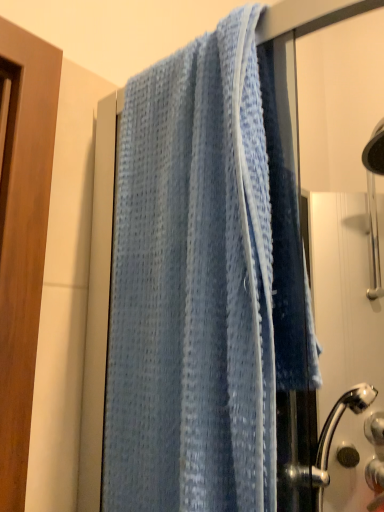
Question: Does light blue waffle-textured towel at center appear on the right side of matte black knob at lower right, acting as the second knob starting from the right?

Choices:
 (A) yes
 (B) no

Answer: (B)

Question: Considering the relative sizes of light blue waffle-textured towel at center and matte black knob at lower right, the first knob viewed from the left, in the image provided, is light blue waffle-textured towel at center taller than matte black knob at lower right, the first knob viewed from the left,?

Choices:
 (A) no
 (B) yes

Answer: (B)

Question: Does light blue waffle-textured towel at center appear on the left side of matte black knob at lower right, the first knob viewed from the left?

Choices:
 (A) no
 (B) yes

Answer: (B)

Question: Is light blue waffle-textured towel at center facing towards matte black knob at lower right, the first knob viewed from the left?

Choices:
 (A) yes
 (B) no

Answer: (B)

Question: From a real-world perspective, is light blue waffle-textured towel at center physically below matte black knob at lower right, acting as the second knob starting from the right?

Choices:
 (A) yes
 (B) no

Answer: (B)

Question: Does light blue waffle-textured towel at center have a greater width compared to matte black knob at lower right, acting as the second knob starting from the right?

Choices:
 (A) no
 (B) yes

Answer: (B)

Question: Is the surface of satin silver knob at lower right, positioned as the second knob in left-to-right order, in direct contact with light blue waffle-textured towel at center?

Choices:
 (A) yes
 (B) no

Answer: (B)

Question: Is satin silver knob at lower right, which appears as the first knob when viewed from the right, thinner than light blue waffle-textured towel at center?

Choices:
 (A) no
 (B) yes

Answer: (B)

Question: Would you say light blue waffle-textured towel at center is part of satin silver knob at lower right, which appears as the first knob when viewed from the right,'s contents?

Choices:
 (A) yes
 (B) no

Answer: (B)

Question: Considering the relative sizes of satin silver knob at lower right, which appears as the first knob when viewed from the right, and light blue waffle-textured towel at center in the image provided, is satin silver knob at lower right, which appears as the first knob when viewed from the right, shorter than light blue waffle-textured towel at center?

Choices:
 (A) yes
 (B) no

Answer: (A)

Question: From a real-world perspective, does satin silver knob at lower right, positioned as the second knob in left-to-right order, sit lower than light blue waffle-textured towel at center?

Choices:
 (A) no
 (B) yes

Answer: (B)

Question: Considering the relative sizes of satin silver knob at lower right, positioned as the second knob in left-to-right order, and light blue waffle-textured towel at center in the image provided, is satin silver knob at lower right, positioned as the second knob in left-to-right order, taller than light blue waffle-textured towel at center?

Choices:
 (A) yes
 (B) no

Answer: (B)

Question: Is blue fabric towel at right at the back of light blue waffle-textured towel at center?

Choices:
 (A) yes
 (B) no

Answer: (A)